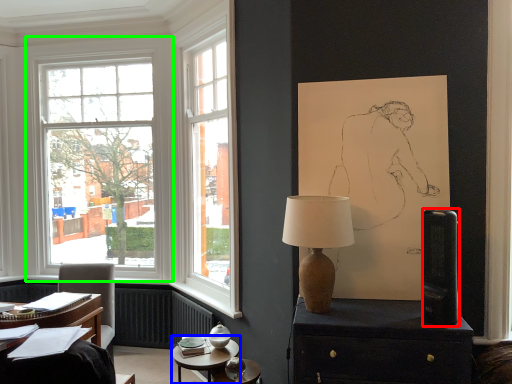
Question: Which object is the closest to the loudspeaker (highlighted by a red box)? Choose among these: table (highlighted by a blue box) or window (highlighted by a green box).

Choices:
 (A) table
 (B) window

Answer: (A)